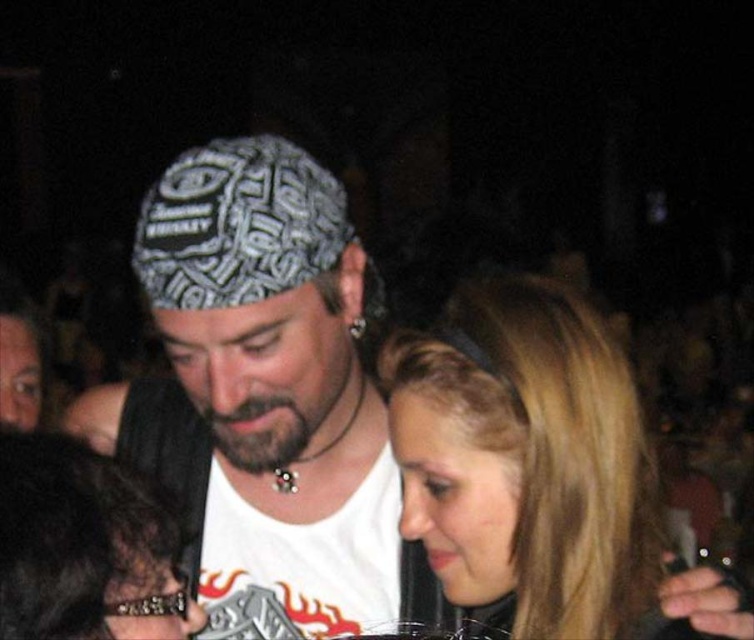
Is white printed t-shirt at center positioned before blonde hair at center?

That is False.

This screenshot has width=754, height=640. What do you see at coordinates (264, 388) in the screenshot? I see `white printed t-shirt at center` at bounding box center [264, 388].

Between point (135, 412) and point (403, 346), which one is positioned behind?

Point (135, 412)

Image resolution: width=754 pixels, height=640 pixels. I want to click on white printed t-shirt at center, so click(x=264, y=388).